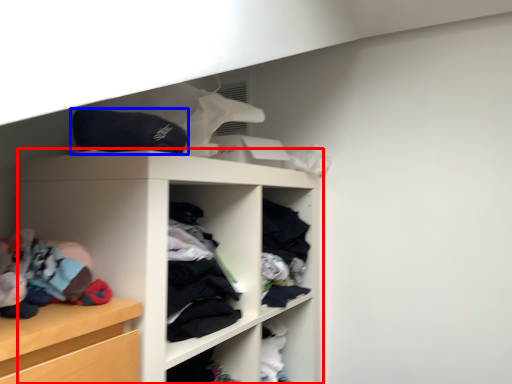
Question: Which object is closer to the camera taking this photo, shelf (highlighted by a red box) or clothing (highlighted by a blue box)?

Choices:
 (A) shelf
 (B) clothing

Answer: (A)